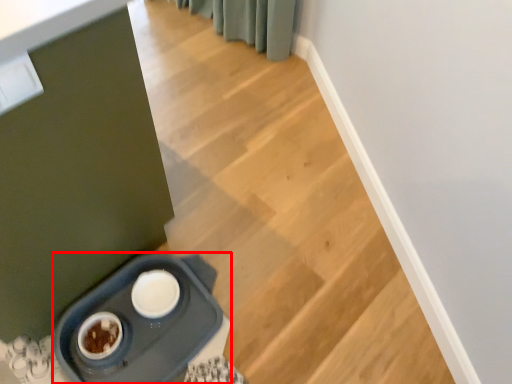
Question: From the image's perspective, considering the relative positions of appliance (annotated by the red box) and stairs in the image provided, where is appliance (annotated by the red box) located with respect to the staircase?

Choices:
 (A) above
 (B) below

Answer: (B)